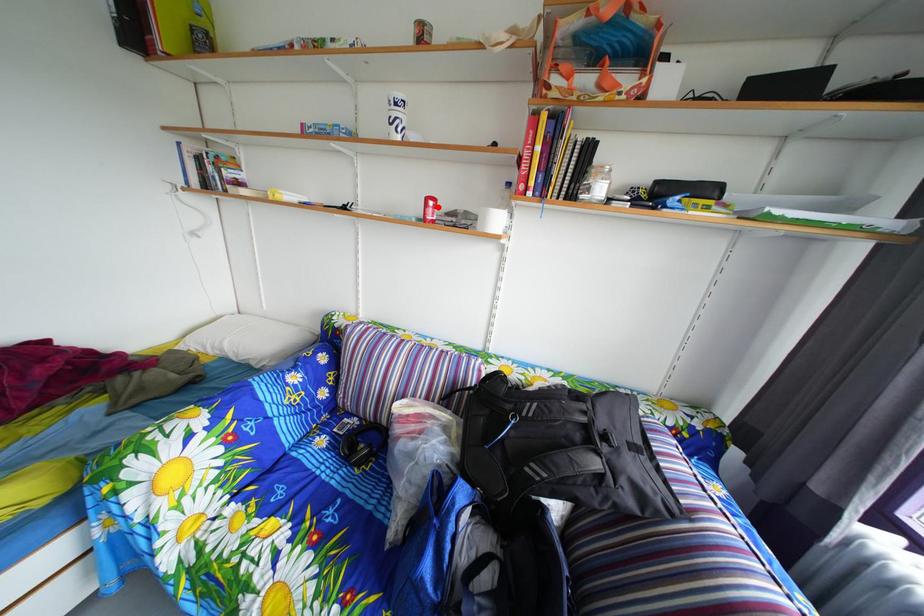
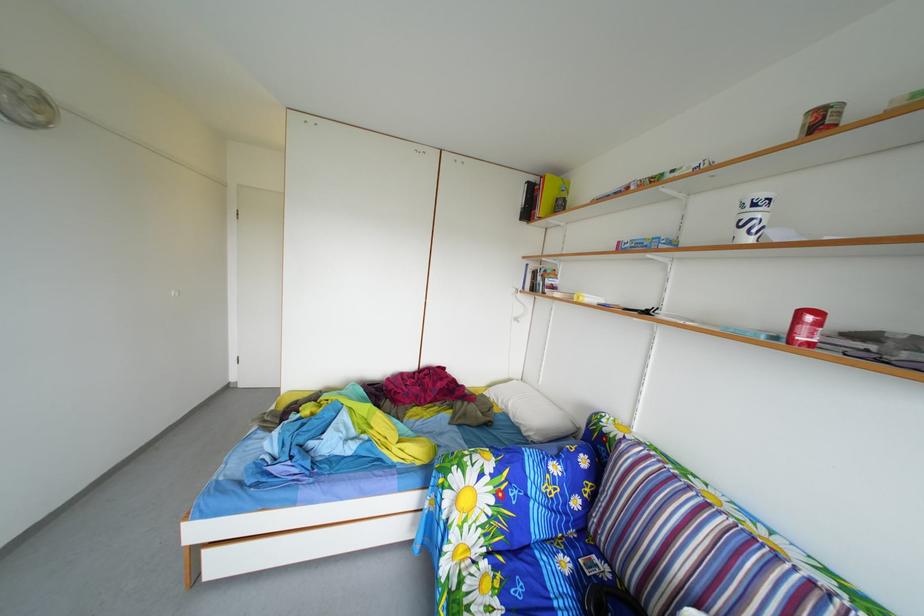
The point at the highlighted location is marked in the first image. Where is the corresponding point in the second image?

(811, 321)